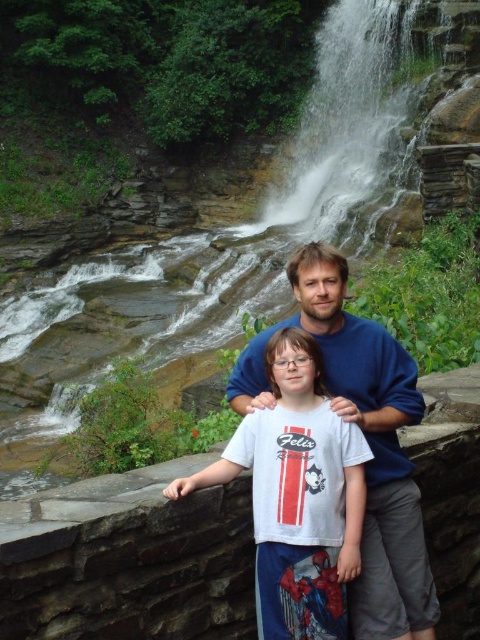
From the picture: You are a photographer trying to capture a photo of the white cotton shirt at center and the blue cotton shirt at center. Which shirt should you focus on first if you want to ensure both shirts are in focus without adjusting your camera settings?

The white cotton shirt at center is shorter than the blue cotton shirt at center, so focusing on the white cotton shirt at center first would ensure both shirts are in focus since it is closer to the camera.

You are organizing a charity event and need to determine clothing sizes for donations. You see two shirts in the image, a white cotton shirt at center and a blue cotton shirt at center. Which shirt has a smaller size?

The white cotton shirt at center has a smaller size compared to the blue cotton shirt at center.

You are a photographer standing behind the waterfall. You want to take a photo of both the white cotton shirt at center and the blue cotton shirt at center in the same frame. Given that your camera has a maximum focus range of 3 meters, will both shirts be in focus?

The distance between the white cotton shirt at center and the blue cotton shirt at center is 3.07 meters. Since the camera can only focus within 3 meters, the shirts are slightly out of the focus range. Therefore, both shirts might not be in focus simultaneously.